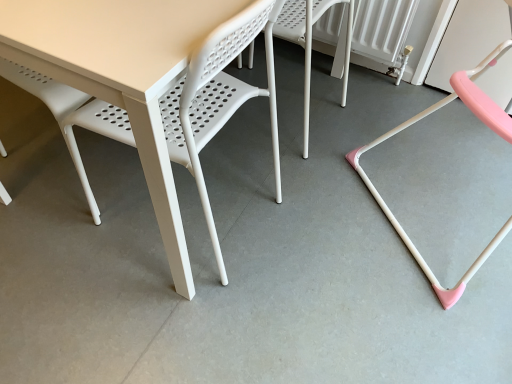
Find the location of a particular element. This screenshot has width=512, height=384. free area in between pink plastic chair at right, which is counted as the second chair, starting from the left, and white plastic chair at center, the 1th chair when ordered from left to right is located at coordinates 366,155.